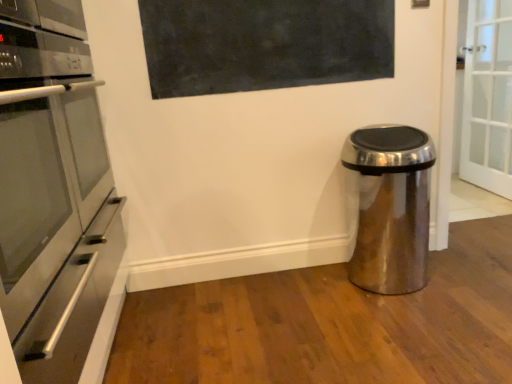
Question: Can you confirm if satin metallic trash can at lower right is smaller than matte black board at upper center?

Choices:
 (A) yes
 (B) no

Answer: (B)

Question: Is satin metallic trash can at lower right oriented towards matte black board at upper center?

Choices:
 (A) yes
 (B) no

Answer: (B)

Question: Can you confirm if satin metallic trash can at lower right is wider than matte black board at upper center?

Choices:
 (A) no
 (B) yes

Answer: (B)

Question: From a real-world perspective, is satin metallic trash can at lower right beneath matte black board at upper center?

Choices:
 (A) no
 (B) yes

Answer: (B)

Question: Is satin metallic trash can at lower right far from matte black board at upper center?

Choices:
 (A) no
 (B) yes

Answer: (A)

Question: Is matte black board at upper center at the back of satin metallic trash can at lower right?

Choices:
 (A) yes
 (B) no

Answer: (B)

Question: From the image's perspective, is stainless steel oven at left on top of matte black board at upper center?

Choices:
 (A) yes
 (B) no

Answer: (B)

Question: Would you say matte black board at upper center is part of stainless steel oven at left's contents?

Choices:
 (A) yes
 (B) no

Answer: (B)

Question: Is stainless steel oven at left to the left of matte black board at upper center from the viewer's perspective?

Choices:
 (A) yes
 (B) no

Answer: (A)

Question: Considering the relative positions of stainless steel oven at left and matte black board at upper center in the image provided, is stainless steel oven at left to the right of matte black board at upper center from the viewer's perspective?

Choices:
 (A) yes
 (B) no

Answer: (B)

Question: From a real-world perspective, is stainless steel oven at left positioned under matte black board at upper center based on gravity?

Choices:
 (A) no
 (B) yes

Answer: (B)

Question: Is stainless steel oven at left facing towards matte black board at upper center?

Choices:
 (A) yes
 (B) no

Answer: (B)

Question: From the image's perspective, does satin metallic trash can at lower right appear lower than stainless steel oven at left?

Choices:
 (A) yes
 (B) no

Answer: (B)